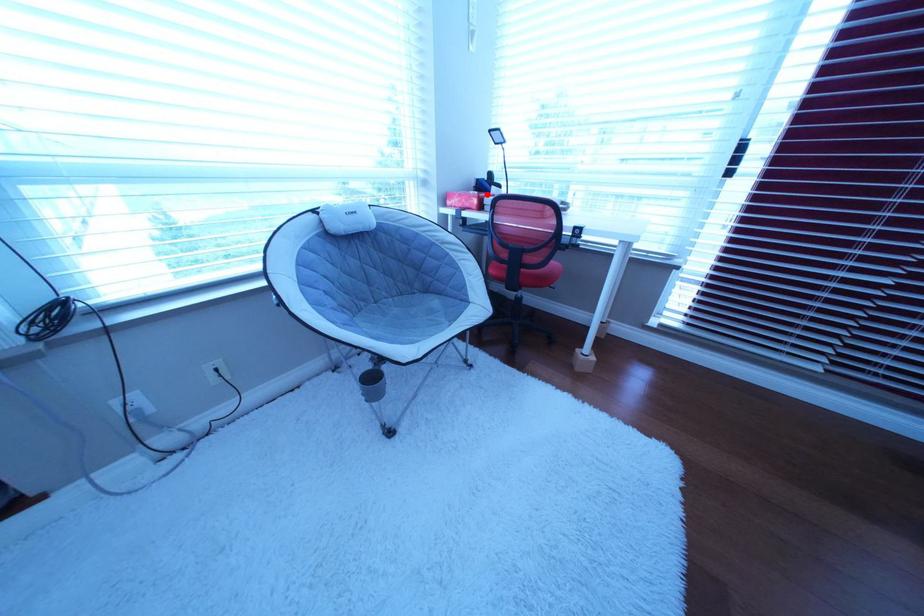
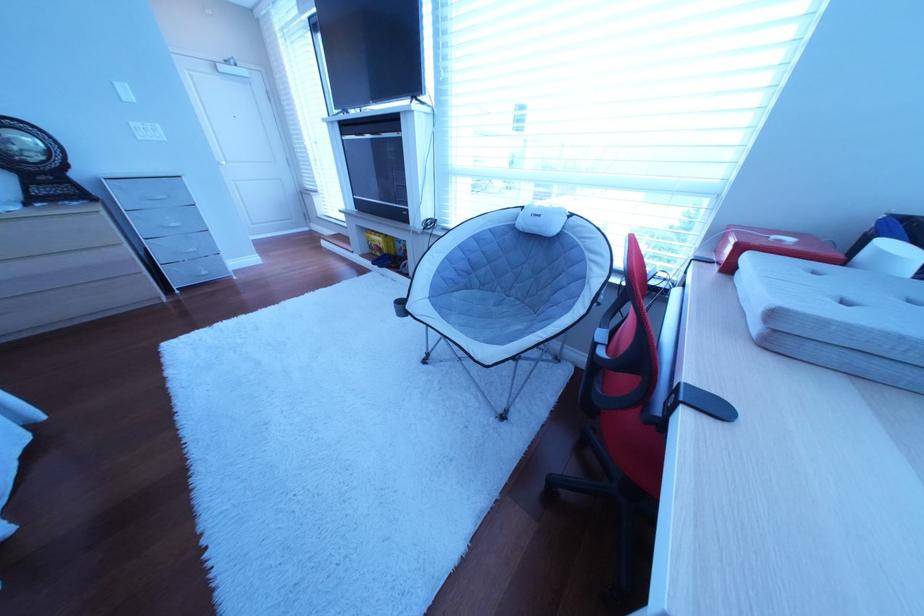
Question: I am providing you with two images of the same scene from different viewpoints. In image1, a red point is highlighted. Considering the same 3D point in image2, which of the following is correct?

Choices:
 (A) It is closer
 (B) It is farther

Answer: (B)